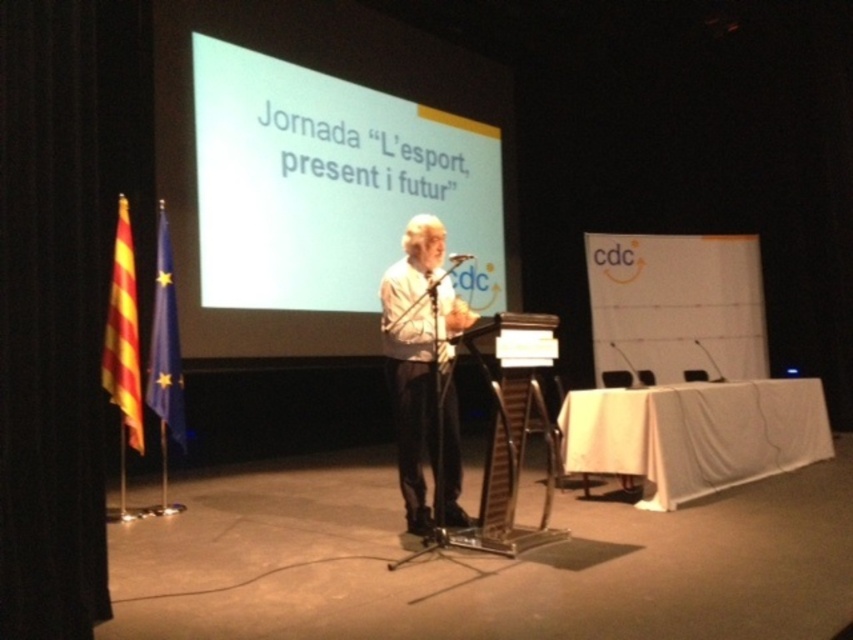
Is point (444, 403) positioned before point (461, 253)?

Yes, point (444, 403) is in front of point (461, 253).

Locate an element on the screen. This screenshot has height=640, width=853. white matte shirt at center is located at coordinates (422, 369).

Is point (453, 472) closer to viewer compared to point (469, 253)?

Yes, it is in front of point (469, 253).

Find the location of `white matte shirt at center`. white matte shirt at center is located at coordinates (422, 369).

Which is below, white matte projection screen at center or white matte shirt at center?

white matte shirt at center is lower down.

Who is taller, white matte projection screen at center or white matte shirt at center?

Standing taller between the two is white matte projection screen at center.

Where is `white matte projection screen at center`? This screenshot has width=853, height=640. white matte projection screen at center is located at coordinates (329, 186).

Locate an element on the screen. white matte projection screen at center is located at coordinates (329, 186).

How far apart are white matte projection screen at center and metallic silver microphone at center?

white matte projection screen at center and metallic silver microphone at center are 1.54 meters apart from each other.

Can you confirm if white matte projection screen at center is smaller than metallic silver microphone at center?

No, white matte projection screen at center is not smaller than metallic silver microphone at center.

The image size is (853, 640). What do you see at coordinates (329, 186) in the screenshot?
I see `white matte projection screen at center` at bounding box center [329, 186].

Image resolution: width=853 pixels, height=640 pixels. In order to click on white matte projection screen at center in this screenshot , I will do (x=329, y=186).